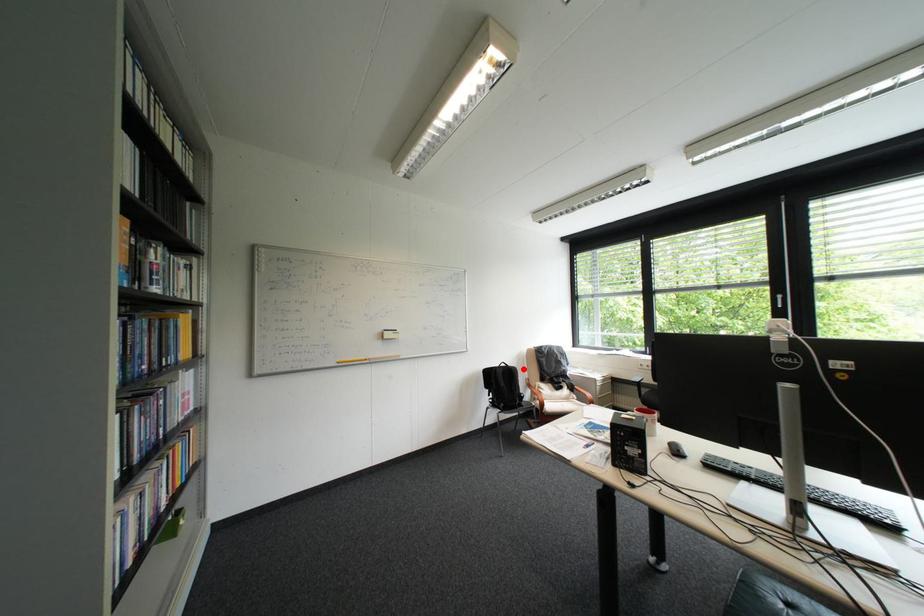
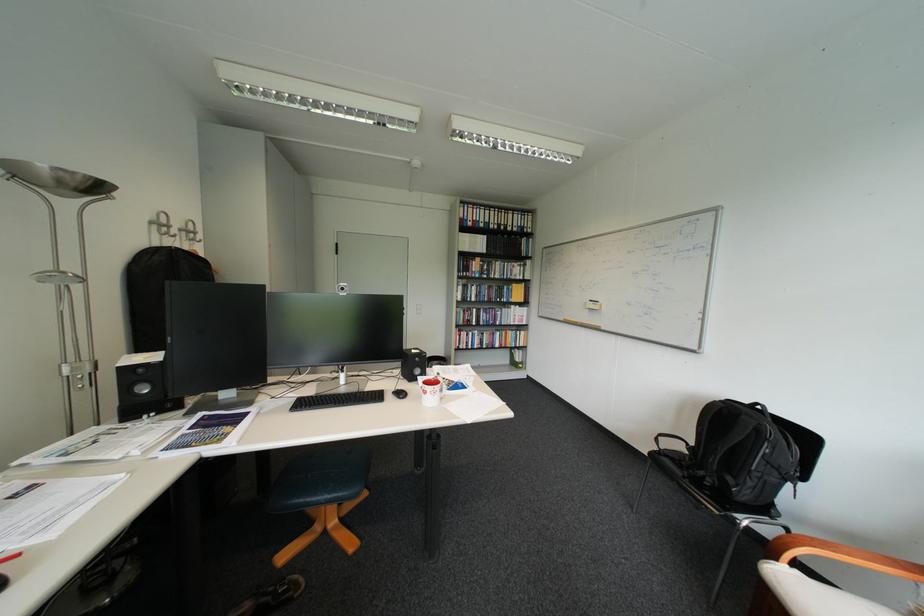
The point at the highlighted location is marked in the first image. Where is the corresponding point in the second image?

(756, 418)